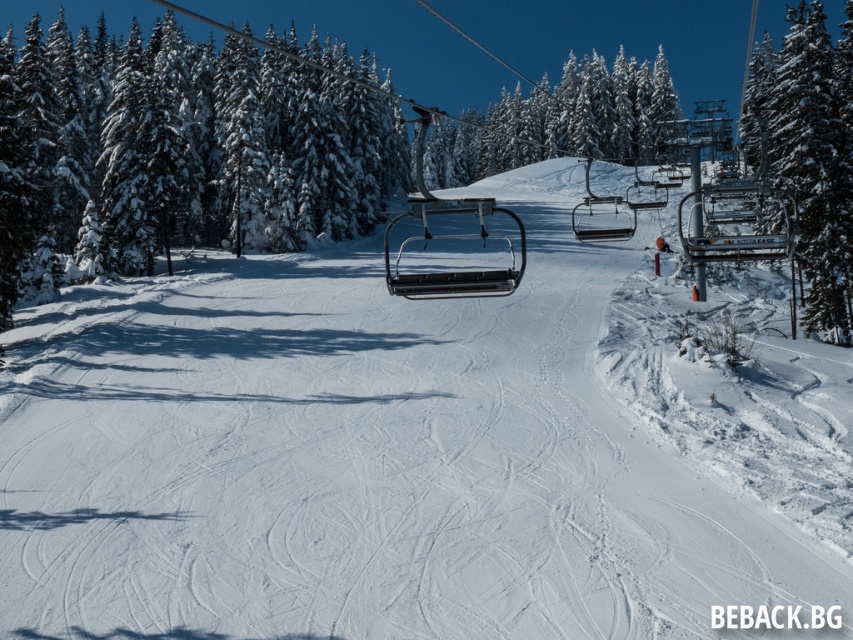
Question: Does metallic black ski lift at center appear on the left side of metallic silver chairlift at center?

Choices:
 (A) no
 (B) yes

Answer: (B)

Question: Is green snow-covered tree at right to the left of green snow-covered tree at center from the viewer's perspective?

Choices:
 (A) yes
 (B) no

Answer: (B)

Question: Which of the following is the closest to the observer?

Choices:
 (A) green snow-covered tree at right
 (B) metallic silver chairlift at center

Answer: (A)

Question: Which point is farther to the camera?

Choices:
 (A) (848, 145)
 (B) (572, 92)

Answer: (B)

Question: Is metallic black ski lift at center thinner than metallic silver chairlift at center?

Choices:
 (A) no
 (B) yes

Answer: (B)

Question: Which object is farther from the camera taking this photo?

Choices:
 (A) green snow-covered tree at right
 (B) metallic black ski lift at center
 (C) green snow-covered tree at center

Answer: (A)